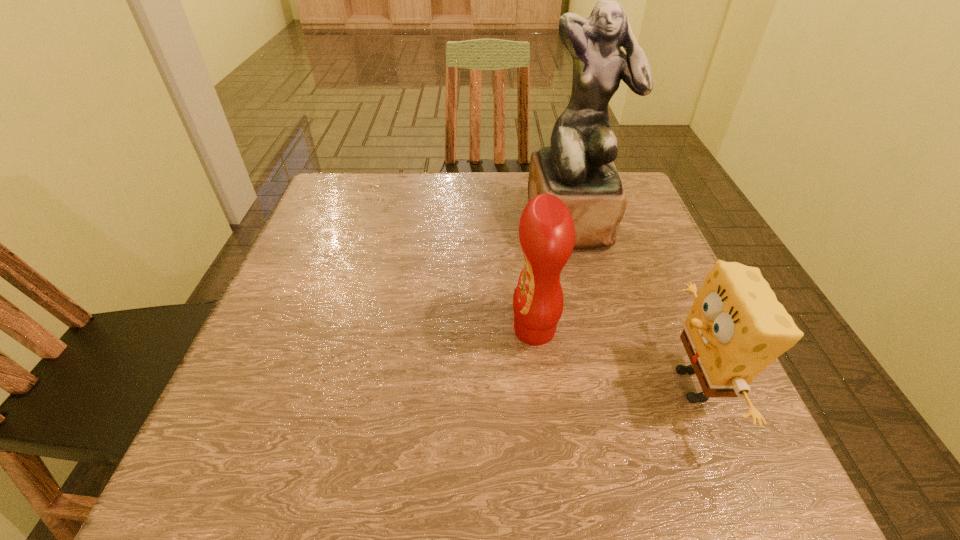
The height and width of the screenshot is (540, 960). In order to click on vacant space at the far right corner of the desktop in this screenshot , I will do `click(630, 188)`.

Locate an element on the screen. free space between the sculpture and the shortest object is located at coordinates (633, 303).

Find the location of a particular element. free space between the sculpture and the shortest object is located at coordinates (633, 303).

Find the location of a particular element. This screenshot has height=540, width=960. vacant area that lies between the condiment and the shortest object is located at coordinates pyautogui.click(x=613, y=357).

You are a GUI agent. You are given a task and a screenshot of the screen. Output one action in this format:
    pyautogui.click(x=<x>, y=<y>)
    Task: Click on the free space between the condiment and the shortest object
    This screenshot has width=960, height=540.
    Given the screenshot: What is the action you would take?
    pyautogui.click(x=613, y=357)

Where is `unoccupied position between the shortest object and the second tallest object`? The width and height of the screenshot is (960, 540). unoccupied position between the shortest object and the second tallest object is located at coordinates (613, 357).

Locate an element on the screen. free space between the condiment and the sponge is located at coordinates (613, 357).

Identify the location of free space between the sponge and the second tallest object. Image resolution: width=960 pixels, height=540 pixels. (613, 357).

Locate an element on the screen. The height and width of the screenshot is (540, 960). free spot between the condiment and the shortest object is located at coordinates (613, 357).

Where is `free space between the shortest object and the tallest object`? free space between the shortest object and the tallest object is located at coordinates (633, 303).